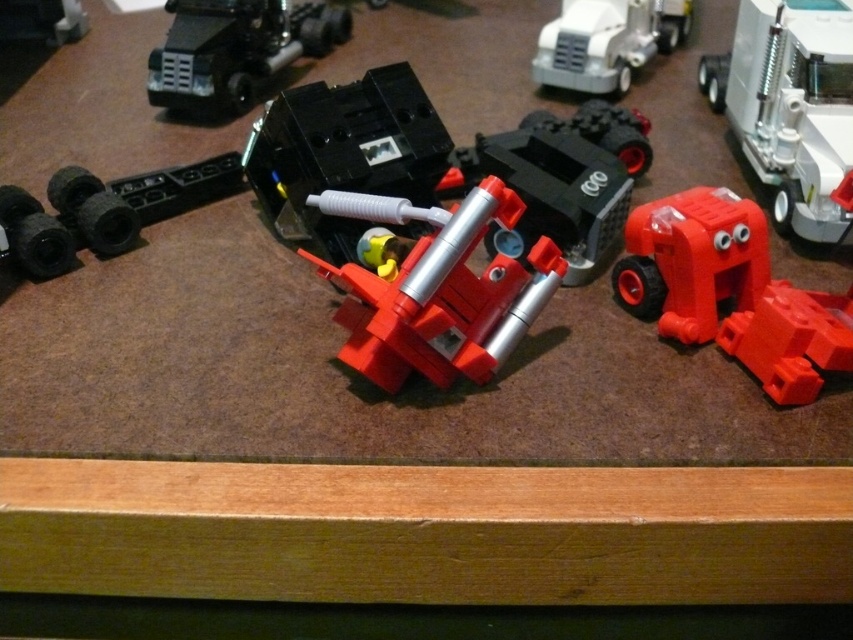
Question: Does matte black truck at upper left have a smaller size compared to white matte truck at upper center?

Choices:
 (A) no
 (B) yes

Answer: (A)

Question: Is matte plastic truck at right thinner than white matte truck at upper center?

Choices:
 (A) yes
 (B) no

Answer: (A)

Question: Which point is closer to the camera?

Choices:
 (A) matte black truck at upper left
 (B) black plastic car at center
 (C) matte plastic truck at right
 (D) matte plastic robot at center

Answer: (D)

Question: Which of these objects is positioned closest to the matte plastic truck at right?

Choices:
 (A) matte black truck at upper left
 (B) rubberized red robot at lower right

Answer: (B)

Question: Can you confirm if matte plastic robot at center is positioned below white matte truck at upper center?

Choices:
 (A) yes
 (B) no

Answer: (A)

Question: Which object is the closest to the matte black truck at upper left?

Choices:
 (A) matte plastic robot at center
 (B) rubberized red robot at lower right
 (C) matte plastic truck at right

Answer: (A)